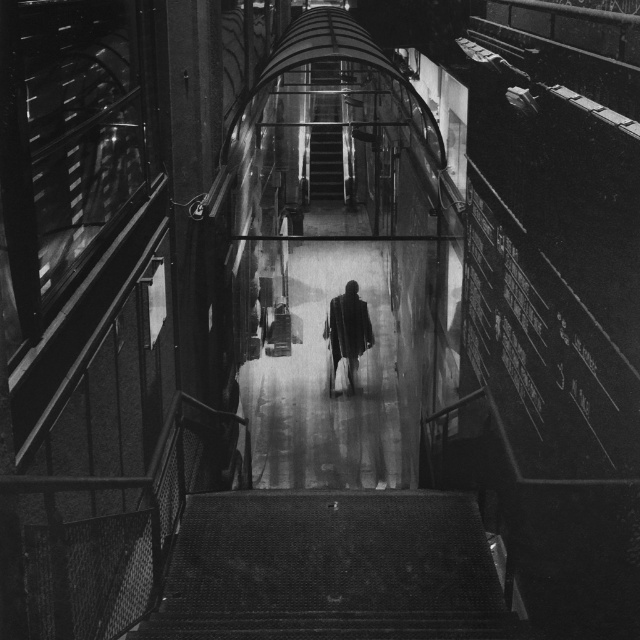
You are a person trying to navigate through the passageway. There are two staircases available. Which one is narrower between the metallic mesh stairs at bottom and the metallic staircase at center?

The metallic mesh stairs at bottom is narrower than the metallic staircase at center because it occupies less space.

From the picture: You are standing at the entrance of the passageway and see the metallic mesh stairs at bottom and the dark textured coat at center. Which object is positioned to the left when viewed from your perspective?

The metallic mesh stairs at bottom are to the left of the dark textured coat at center.

You are a person standing at the entrance of the passageway and want to climb up to the upper level. There is a metallic staircase at center and a dark textured coat at center in your view. Which object is taller and should you focus on to locate the staircase?

The metallic staircase at center is much taller than the dark textured coat at center, so you should focus on the metallic staircase at center to locate it.